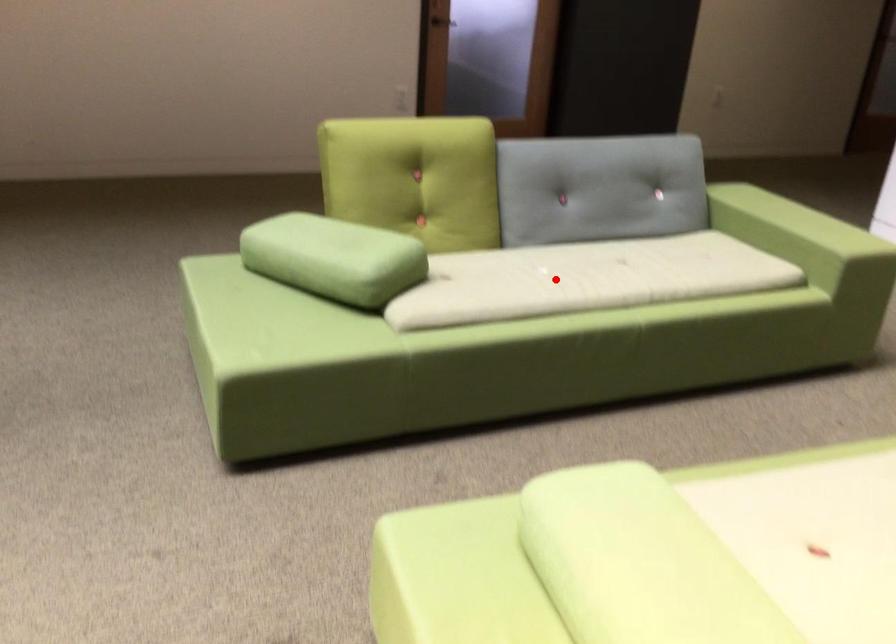
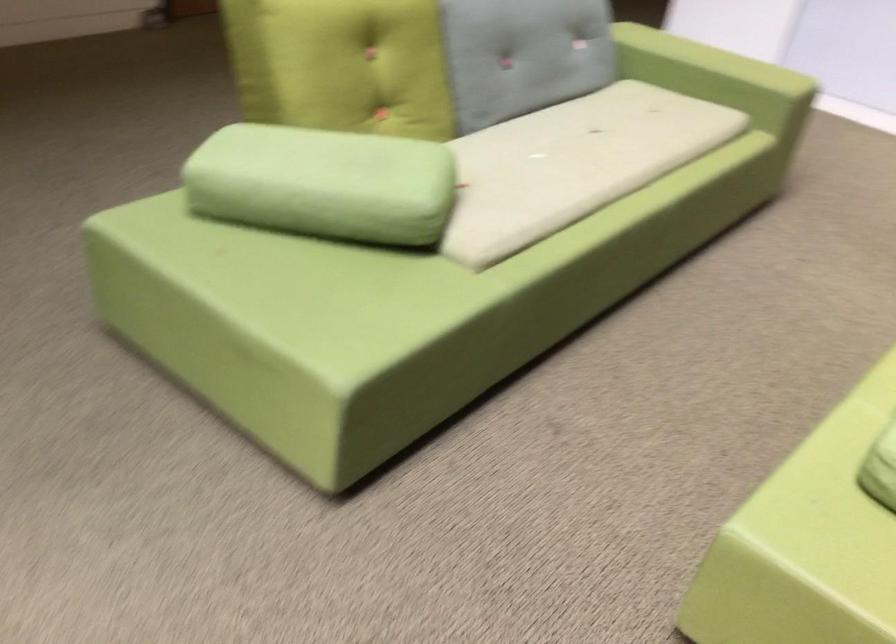
Find the pixel in the second image that matches the highlighted location in the first image.

(572, 164)